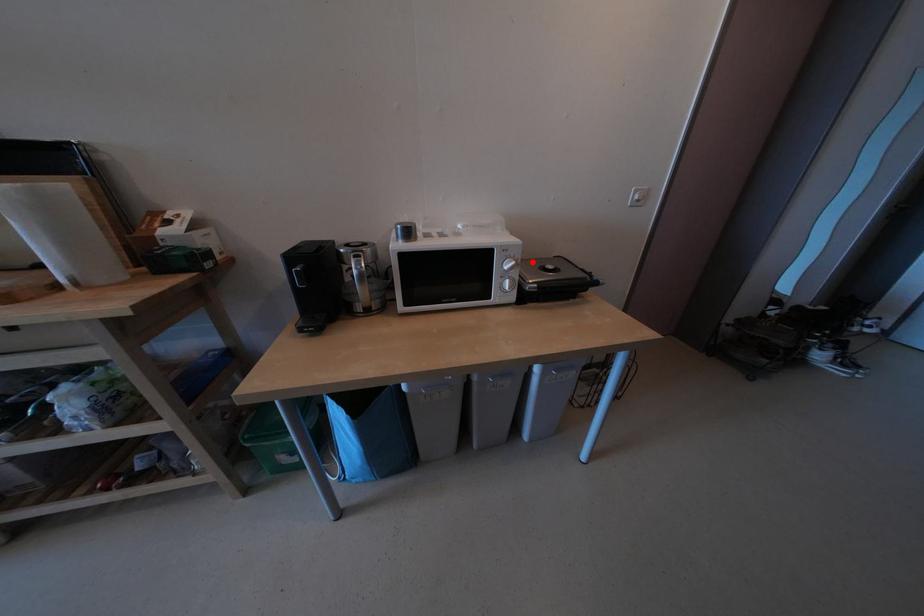
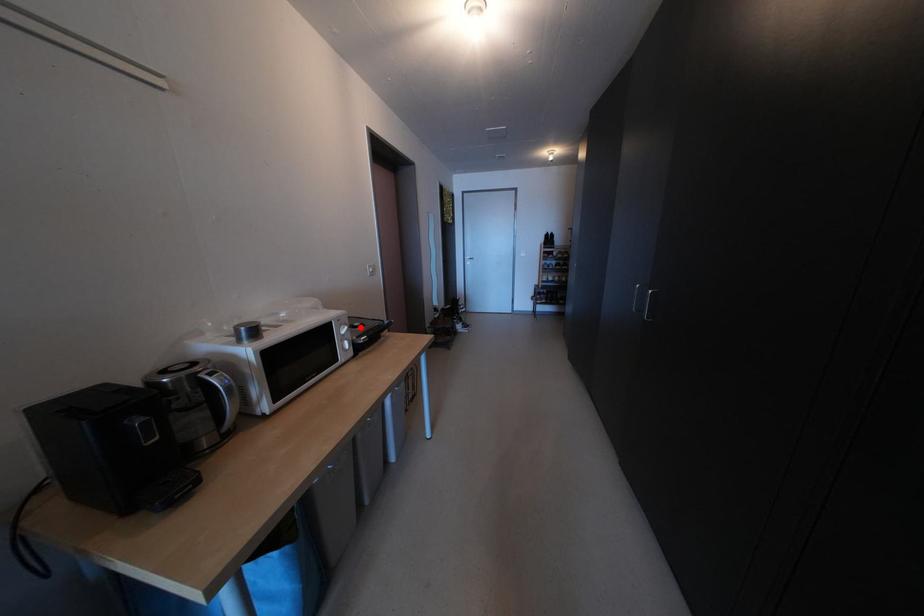
I am providing you with two images of the same scene from different viewpoints. A red point is marked on the first image and another point is marked on the second image. Is the marked point in image1 the same physical position as the marked point in image2?

Yes